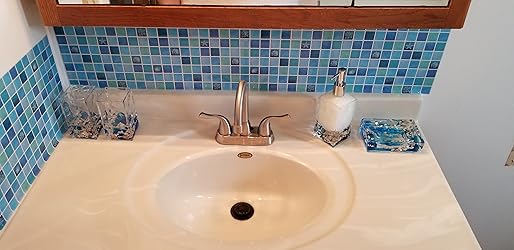
This screenshot has height=250, width=514. Identify the location of white wall. (x=11, y=23), (x=479, y=97).